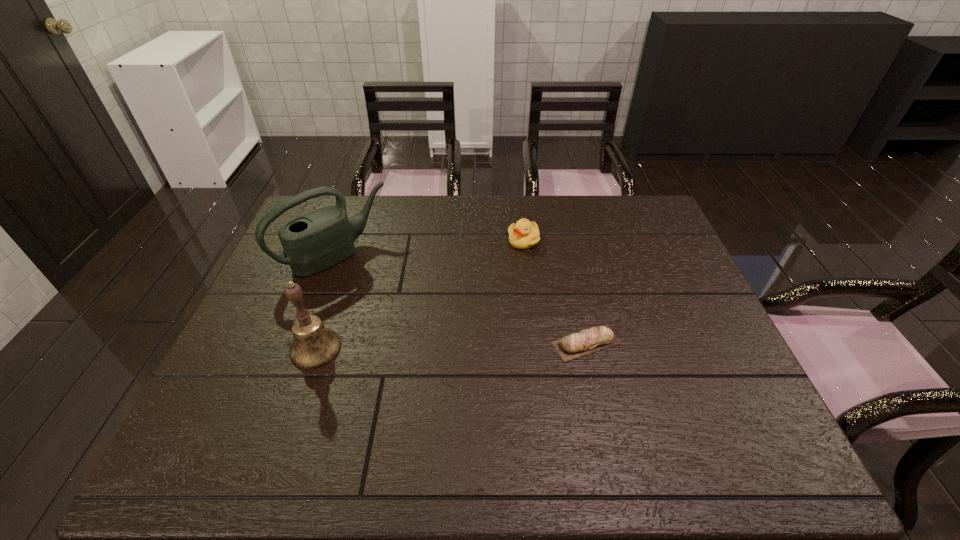
You are a GUI agent. You are given a task and a screenshot of the screen. Output one action in this format:
    pyautogui.click(x=<x>, y=<y>)
    Task: Click on the free region located at the face of the duckling
    
    Given the screenshot: What is the action you would take?
    pyautogui.click(x=495, y=284)

Locate an element on the screen. The width and height of the screenshot is (960, 540). vacant space located at the face of the duckling is located at coordinates (490, 293).

Identify the location of watering can located at the far edge. (318, 240).

This screenshot has height=540, width=960. In order to click on duckling present at the far edge in this screenshot , I will do `click(524, 234)`.

Where is `bell that is positioned at the left edge`? bell that is positioned at the left edge is located at coordinates (314, 345).

The height and width of the screenshot is (540, 960). In order to click on watering can located in the left edge section of the desktop in this screenshot , I will do 318,240.

This screenshot has width=960, height=540. What are the coordinates of `object positioned at the far left corner` in the screenshot? It's located at (318, 240).

In the image, there is a desktop. Find the location of `vacant space at the far edge`. vacant space at the far edge is located at coordinates (574, 201).

The height and width of the screenshot is (540, 960). Find the location of `free space at the near edge of the desktop`. free space at the near edge of the desktop is located at coordinates (569, 415).

In the image, there is a desktop. Find the location of `vacant region at the left edge`. vacant region at the left edge is located at coordinates (264, 286).